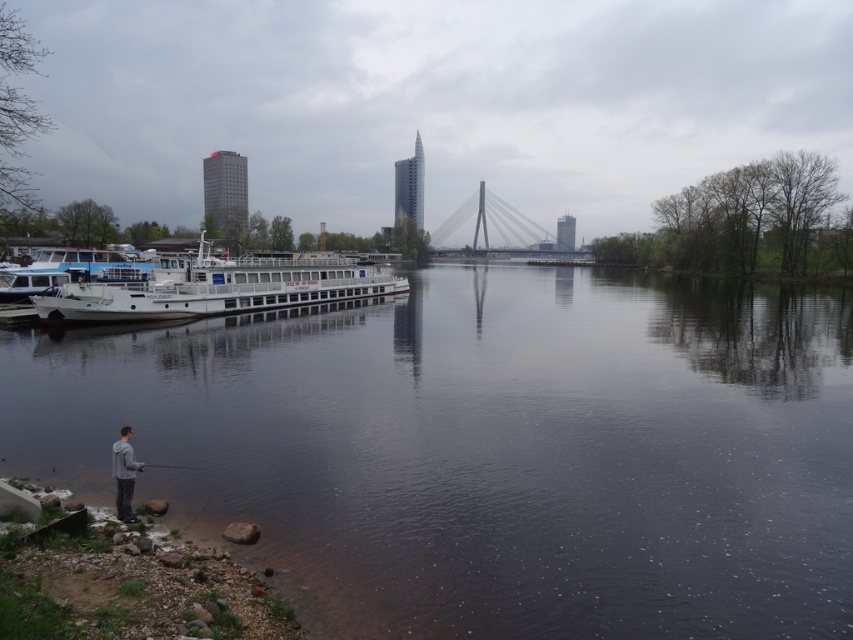
You are standing at the center of the image, looking towards the river. Where is the white glossy boat at left located relative to your position?

The white glossy boat at left is located to the left side of your position, at coordinates approximately 0.450 on the x axis and 0.256 on the y axis.

You are standing at the riverside and want to walk towards both points marked in the image. Which point, point (107, 320) or point (125, 493), will you reach first?

Point (107, 320) is closer to you than point (125, 493), so you will reach point (107, 320) first.

You are a photographer planning to take a reflection shot of the white glossy boat at left and the dark reflective water at center. Since reflections are best captured when the water is calm, does the scene allow for a clear reflection of the boat in the water?

The dark reflective water at center is positioned under the white glossy boat at left, so yes, the reflection of the white glossy boat at left in the dark reflective water at center should be clear as the water is calm and reflective.